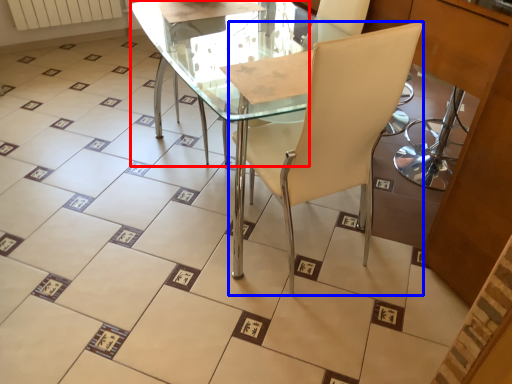
Question: Which point is further to the camera, round table (highlighted by a red box) or chair (highlighted by a blue box)?

Choices:
 (A) round table
 (B) chair

Answer: (A)